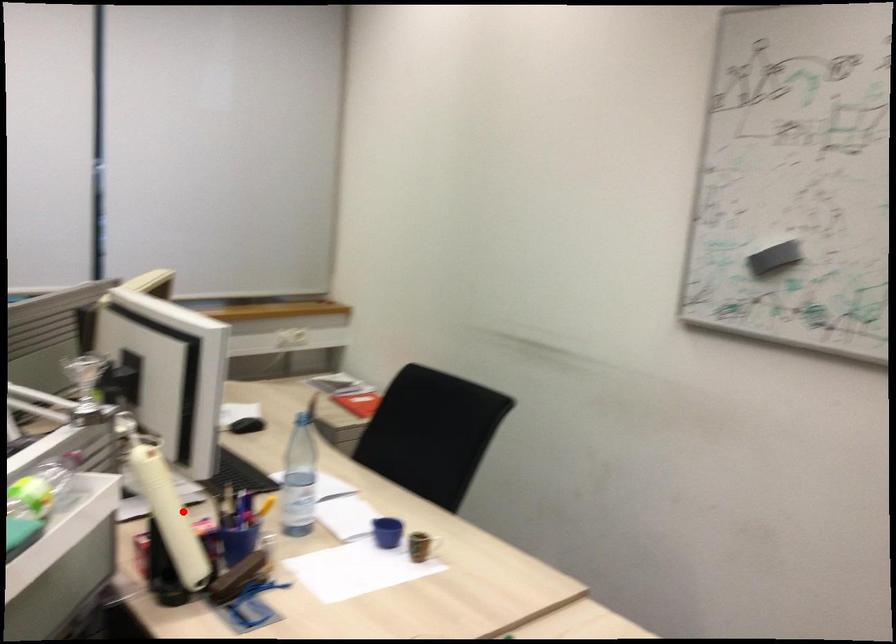
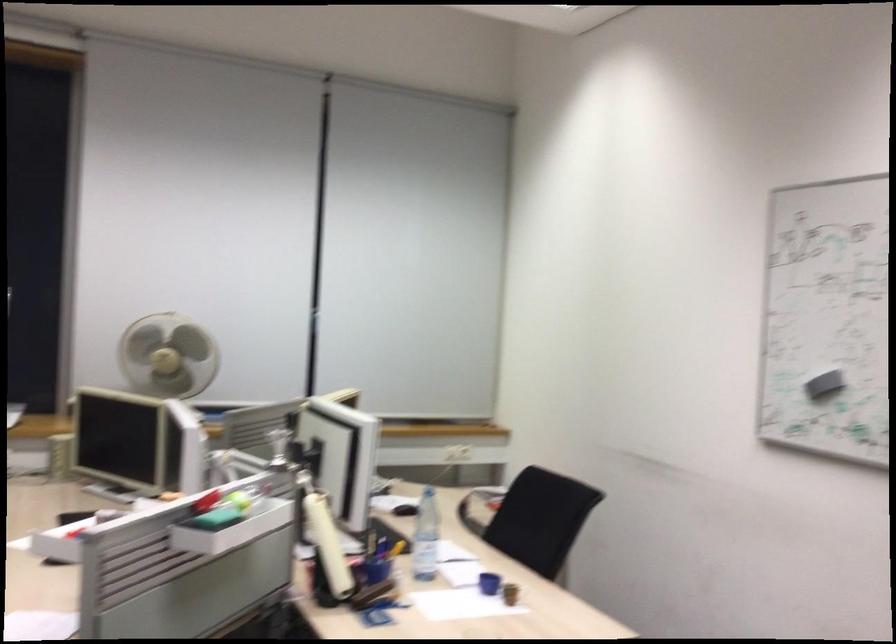
Question: A red point is marked in image1. In image2, is the corresponding 3D point closer to the camera or farther? Reply with the corresponding letter.

Choices:
 (A) The corresponding 3D point is closer.
 (B) The corresponding 3D point is farther.

Answer: (B)